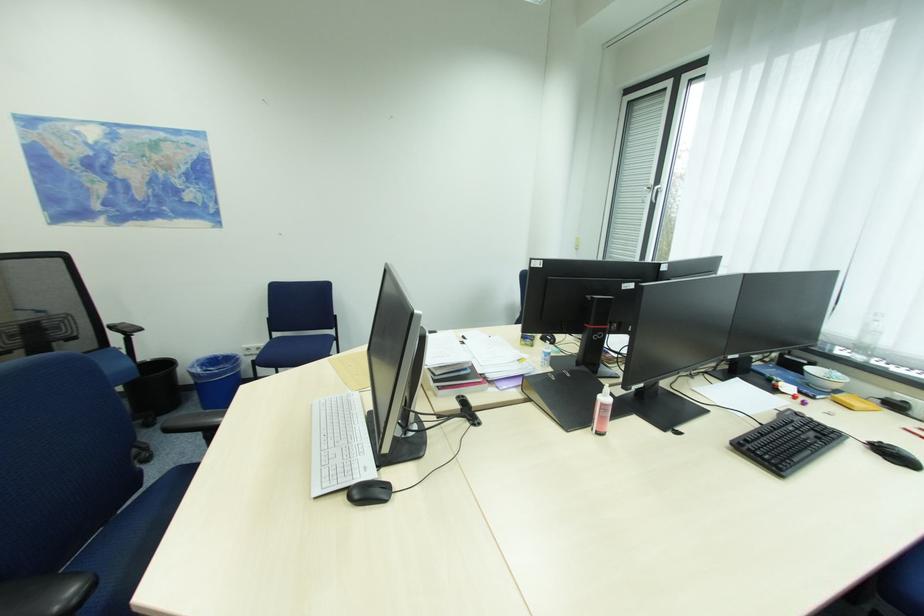
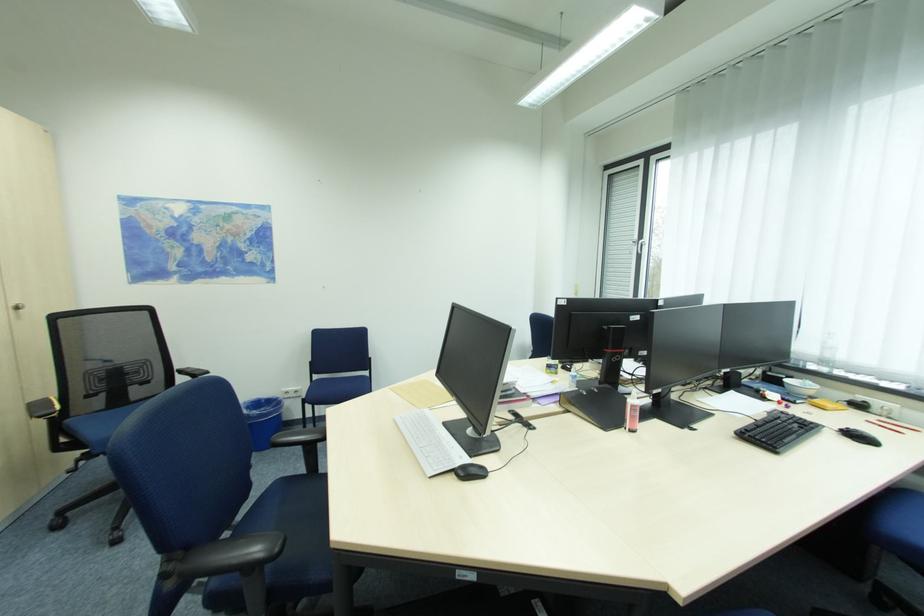
Question: The first image is from the beginning of the video and the second image is from the end. How did the camera likely rotate when shooting the video?

Choices:
 (A) Left
 (B) Right
 (C) Up
 (D) Down

Answer: (C)